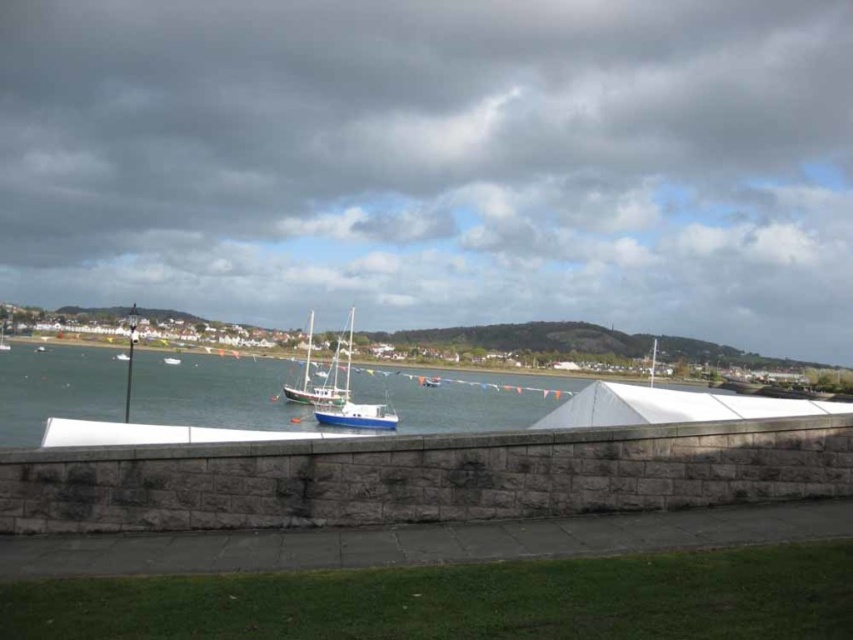
You are a photographer positioned on the stone wall with the white covering. You want to take a photo of the blue polished wood sailboat at center without the wooden sailboat at center blocking it. Is this possible?

The blue polished wood sailboat at center is behind the wooden sailboat at center, so it would be blocked. To capture the blue polished wood sailboat at center without obstruction, you would need to reposition yourself or wait for the wooden sailboat at center to move.

You are standing at the stone wall in the waterfront scene. You see two points marked as point 1 at location (x=349, y=342) and point 2 at (x=381, y=420). Which point is closer to you?

Point 1 at location (x=349, y=342) is closer to you because it is further to the camera than point 2 at (x=381, y=420).